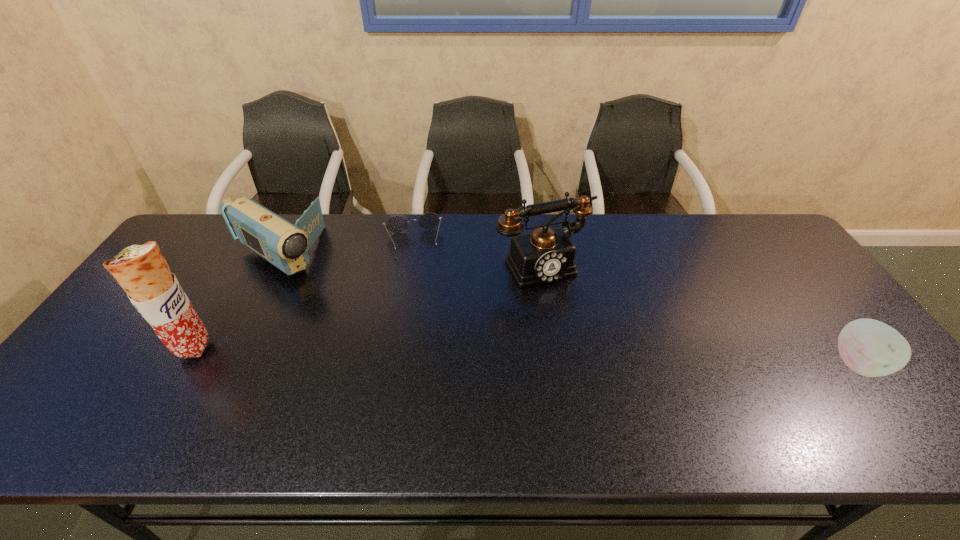
The width and height of the screenshot is (960, 540). I want to click on free point between the tallest object and the shortest object, so click(302, 295).

The width and height of the screenshot is (960, 540). What are the coordinates of `unoccupied position between the burrito and the third shortest object` in the screenshot? It's located at (236, 301).

At what (x,y) coordinates should I click in order to perform the action: click on vacant area that lies between the apple and the burrito. Please return your answer as a coordinate pair (x, y). The width and height of the screenshot is (960, 540). Looking at the image, I should click on (525, 356).

Identify the location of vacant point located between the third object from left to right and the third tallest object. (346, 248).

The height and width of the screenshot is (540, 960). What are the coordinates of `free spot between the shortest object and the fourth shortest object` in the screenshot? It's located at (477, 253).

The image size is (960, 540). In order to click on vacant space that is in between the second tallest object and the burrito in this screenshot , I will do `click(367, 306)`.

Identify the location of unoccupied position between the fourth object from left to right and the shortest object. (477, 253).

Where is `free spot between the shortest object and the camcorder`? This screenshot has height=540, width=960. free spot between the shortest object and the camcorder is located at coordinates (346, 248).

This screenshot has width=960, height=540. In order to click on vacant space that is in between the apple and the third object from left to right in this screenshot , I will do `click(635, 303)`.

Image resolution: width=960 pixels, height=540 pixels. I want to click on vacant area between the third object from left to right and the third tallest object, so click(346, 248).